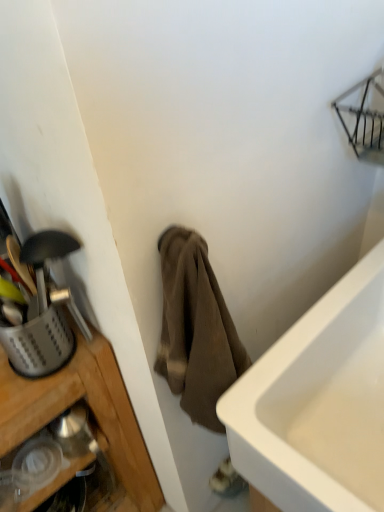
The image size is (384, 512). What do you see at coordinates (196, 329) in the screenshot? I see `brown cotton towel at center` at bounding box center [196, 329].

In order to face brown cotton towel at center, should I rotate leftwards or rightwards?

To face it directly, rotate right by 1.166 degrees.

Locate an element on the screen. This screenshot has height=512, width=384. brown cotton towel at center is located at coordinates (196, 329).

The image size is (384, 512). I want to click on silver/metallic utensil basket at left, so click(x=38, y=343).

Describe the element at coordinates (38, 343) in the screenshot. I see `silver/metallic utensil basket at left` at that location.

Locate an element on the screen. The height and width of the screenshot is (512, 384). brown cotton towel at center is located at coordinates (196, 329).

Between silver/metallic utensil basket at left and brown cotton towel at center, which one appears on the left side from the viewer's perspective?

silver/metallic utensil basket at left.

Is silver/metallic utensil basket at left closer to the viewer compared to brown cotton towel at center?

That is False.

Which is nearer, (x=11, y=352) or (x=239, y=353)?

Point (x=11, y=352) appears to be farther away from the viewer than point (x=239, y=353).

From the image's perspective, is silver/metallic utensil basket at left below brown cotton towel at center?

Incorrect, from the image's perspective, silver/metallic utensil basket at left is higher than brown cotton towel at center.

From a real-world perspective, is silver/metallic utensil basket at left positioned above or below brown cotton towel at center?

From a real-world perspective, silver/metallic utensil basket at left is physically above brown cotton towel at center.

Can you confirm if silver/metallic utensil basket at left is wider than brown cotton towel at center?

No.

Is silver/metallic utensil basket at left shorter than brown cotton towel at center?

Yes, silver/metallic utensil basket at left is shorter than brown cotton towel at center.

Which of these two, silver/metallic utensil basket at left or brown cotton towel at center, is bigger?

Bigger between the two is brown cotton towel at center.

Is silver/metallic utensil basket at left outside of brown cotton towel at center?

Yes, silver/metallic utensil basket at left is outside of brown cotton towel at center.

Is silver/metallic utensil basket at left in contact with brown cotton towel at center?

There is a gap between silver/metallic utensil basket at left and brown cotton towel at center.

Is silver/metallic utensil basket at left oriented towards brown cotton towel at center?

No, silver/metallic utensil basket at left is not aimed at brown cotton towel at center.

How many degrees apart are the facing directions of silver/metallic utensil basket at left and brown cotton towel at center?

3.23 degrees.

Identify the location of towel/napkin below the silver/metallic utensil basket at left (from the image's perspective). The width and height of the screenshot is (384, 512). tap(196, 329).

Is brown cotton towel at center at the left side of silver/metallic utensil basket at left?

In fact, brown cotton towel at center is to the right of silver/metallic utensil basket at left.

Considering the relative positions of brown cotton towel at center and silver/metallic utensil basket at left in the image provided, is brown cotton towel at center behind silver/metallic utensil basket at left?

No, brown cotton towel at center is closer to the camera.

Which is in front, point (198, 398) or point (10, 361)?

Positioned in front is point (198, 398).

From the image's perspective, would you say brown cotton towel at center is shown under silver/metallic utensil basket at left?

Correct, brown cotton towel at center appears lower than silver/metallic utensil basket at left in the image.

From a real-world perspective, is brown cotton towel at center under silver/metallic utensil basket at left?

Yes, from a real-world perspective, brown cotton towel at center is below silver/metallic utensil basket at left.

Is brown cotton towel at center wider than silver/metallic utensil basket at left?

Yes, brown cotton towel at center is wider than silver/metallic utensil basket at left.

Can you confirm if brown cotton towel at center is shorter than silver/metallic utensil basket at left?

Incorrect, the height of brown cotton towel at center does not fall short of that of silver/metallic utensil basket at left.

Is brown cotton towel at center bigger than silver/metallic utensil basket at left?

Yes, brown cotton towel at center is bigger than silver/metallic utensil basket at left.

Based on the photo, is brown cotton towel at center inside or outside of silver/metallic utensil basket at left?

brown cotton towel at center is not inside silver/metallic utensil basket at left, it's outside.

Is brown cotton towel at center far away from silver/metallic utensil basket at left?

No, brown cotton towel at center is not far from silver/metallic utensil basket at left.

Is brown cotton towel at center oriented away from silver/metallic utensil basket at left?

No, silver/metallic utensil basket at left is not at the back of brown cotton towel at center.

Can you tell me how much brown cotton towel at center and silver/metallic utensil basket at left differ in facing direction?

There is a 3.23-degree angle between the facing directions of brown cotton towel at center and silver/metallic utensil basket at left.

How far apart are brown cotton towel at center and silver/metallic utensil basket at left?

10.58 inches.

Locate an element on the screen. This screenshot has height=512, width=384. towel/napkin on the right of the silver/metallic utensil basket at left is located at coordinates (196, 329).

Identify the location of towel/napkin beneath the silver/metallic utensil basket at left (from a real-world perspective). Image resolution: width=384 pixels, height=512 pixels. (196, 329).

I want to click on towel/napkin on the right side of silver/metallic utensil basket at left, so click(x=196, y=329).